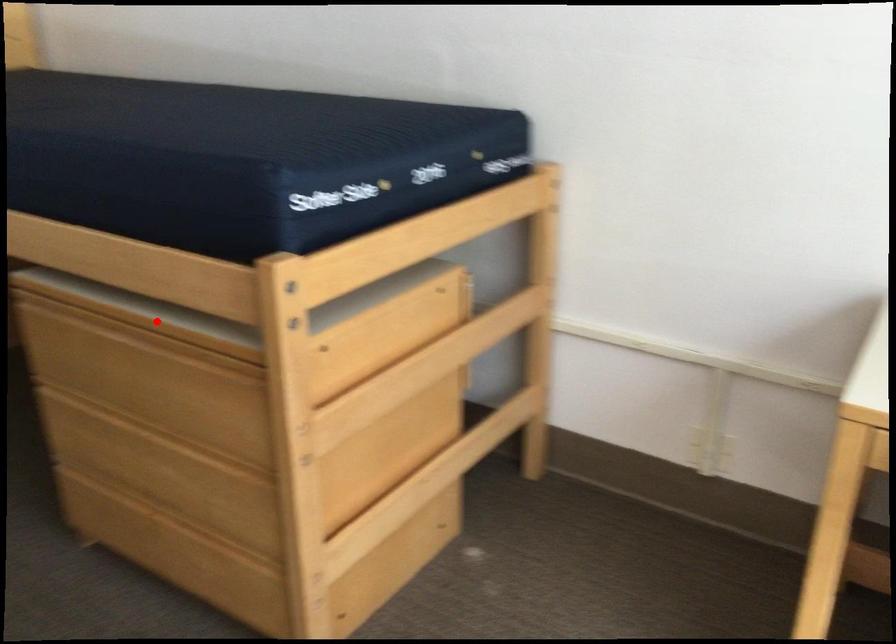
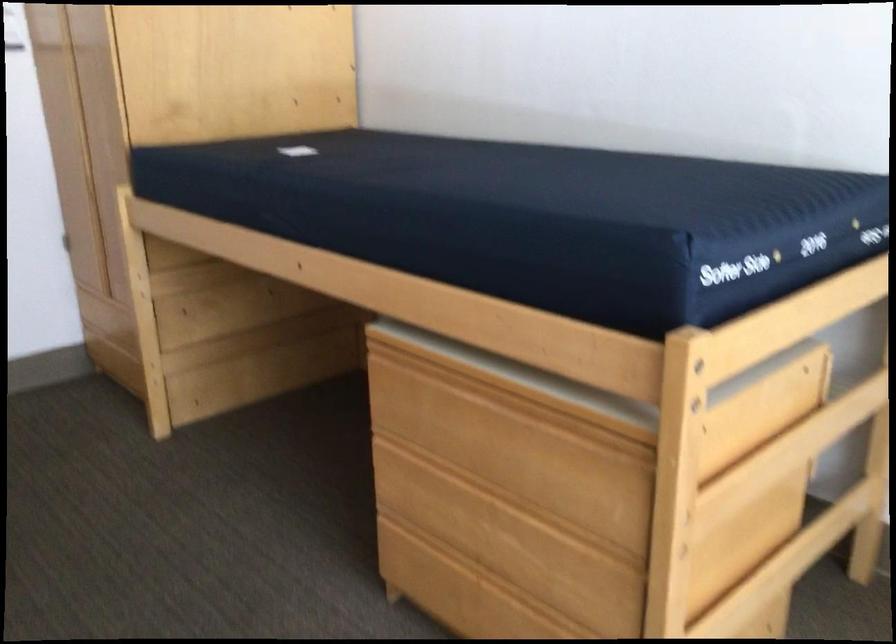
The point at the highlighted location is marked in the first image. Where is the corresponding point in the second image?

(520, 383)